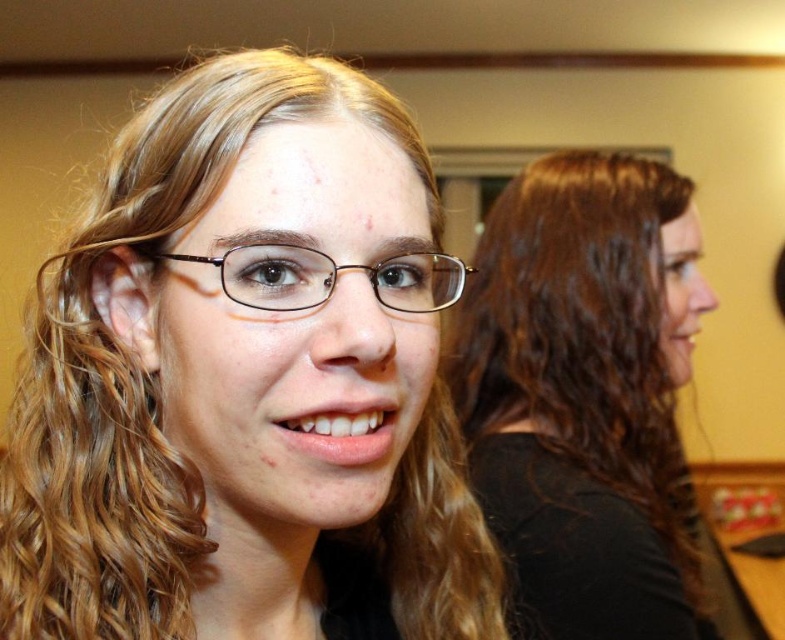
Can you confirm if matte black hair at center is positioned to the left of brown plastic glasses at center?

Correct, you'll find matte black hair at center to the left of brown plastic glasses at center.

Who is higher up, matte black hair at center or brown plastic glasses at center?

brown plastic glasses at center is higher up.

What do you see at coordinates (247, 381) in the screenshot? I see `matte black hair at center` at bounding box center [247, 381].

You are a GUI agent. You are given a task and a screenshot of the screen. Output one action in this format:
    pyautogui.click(x=<x>, y=<y>)
    Task: Click on the matte black hair at center
    Image resolution: width=785 pixels, height=640 pixels.
    Given the screenshot: What is the action you would take?
    pyautogui.click(x=247, y=381)

This screenshot has width=785, height=640. I want to click on matte black hair at center, so click(x=247, y=381).

Who is taller, matte black hair at center or dark brown hair at upper right?

dark brown hair at upper right is taller.

Does point (227, 580) come in front of point (568, 340)?

Yes.

Locate an element on the screen. The width and height of the screenshot is (785, 640). matte black hair at center is located at coordinates (247, 381).

Can you confirm if dark brown hair at upper right is positioned below brown plastic glasses at center?

Indeed, dark brown hair at upper right is positioned under brown plastic glasses at center.

The width and height of the screenshot is (785, 640). What do you see at coordinates (583, 397) in the screenshot?
I see `dark brown hair at upper right` at bounding box center [583, 397].

This screenshot has width=785, height=640. Describe the element at coordinates (583, 397) in the screenshot. I see `dark brown hair at upper right` at that location.

The height and width of the screenshot is (640, 785). In order to click on dark brown hair at upper right in this screenshot , I will do `click(583, 397)`.